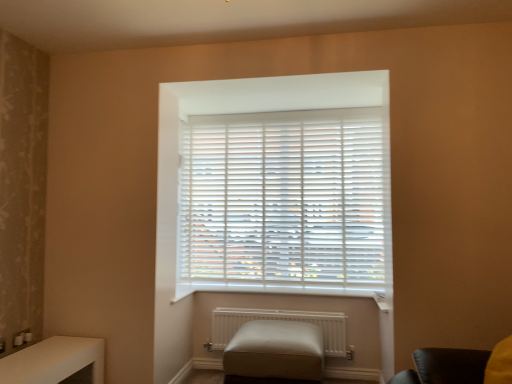
Question: Does point (86, 344) appear closer or farther from the camera than point (224, 339)?

Choices:
 (A) closer
 (B) farther

Answer: (A)

Question: In terms of height, does white glossy table at lower left look taller or shorter compared to white matte radiator at lower center?

Choices:
 (A) tall
 (B) short

Answer: (A)

Question: Which is farther from the white matte radiator at lower center?

Choices:
 (A) white glossy table at lower left
 (B) white matte blinds at center
 (C) beige leather ottoman at center

Answer: (A)

Question: Estimate the real-world distances between objects in this image. Which object is farther from the white matte blinds at center?

Choices:
 (A) white matte radiator at lower center
 (B) beige leather ottoman at center
 (C) white glossy table at lower left

Answer: (C)